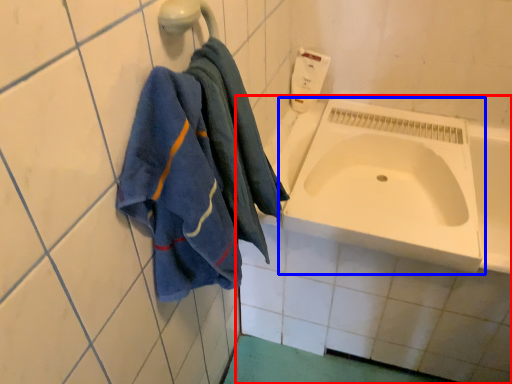
Question: Which object is further to the camera taking this photo, bath (highlighted by a red box) or sink (highlighted by a blue box)?

Choices:
 (A) bath
 (B) sink

Answer: (B)